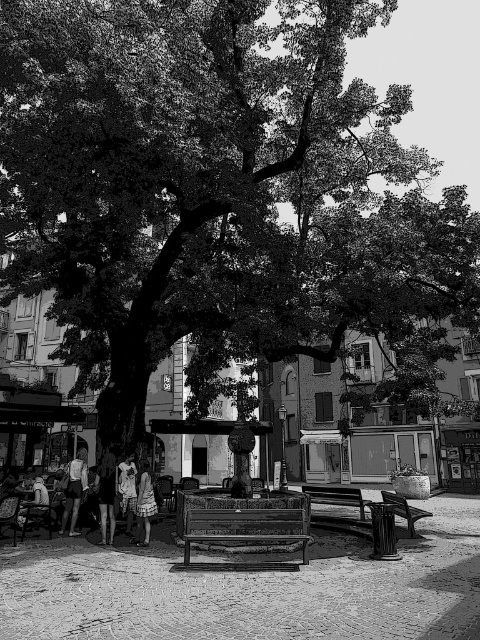
Consider the image. Is white cotton dress at center below wooden bench at lower right?

No.

Describe the element at coordinates (144, 506) in the screenshot. The height and width of the screenshot is (640, 480). I see `white cotton dress at center` at that location.

Is point (146, 513) more distant than point (408, 529)?

No, it is in front of (408, 529).

Where is `white cotton dress at center`? The width and height of the screenshot is (480, 640). white cotton dress at center is located at coordinates (144, 506).

Can you confirm if dark fabric dress at center is positioned below wooden bench at lower right?

Incorrect, dark fabric dress at center is not positioned below wooden bench at lower right.

Does dark fabric dress at center appear over wooden bench at lower right?

Yes, dark fabric dress at center is above wooden bench at lower right.

Locate an element on the screen. dark fabric dress at center is located at coordinates (106, 493).

Image resolution: width=480 pixels, height=640 pixels. In order to click on dark fabric dress at center in this screenshot , I will do `click(106, 493)`.

Which is above, light brown fabric dress at center or wooden bench at lower right?

light brown fabric dress at center is higher up.

Is point (127, 532) positioned before point (385, 496)?

Yes, point (127, 532) is closer to viewer.

This screenshot has width=480, height=640. I want to click on light brown fabric dress at center, so click(x=127, y=490).